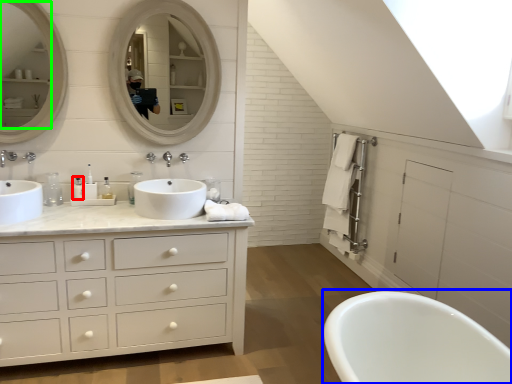
Question: Based on their relative distances, which object is farther from toiletry (highlighted by a red box)? Choose from bath (highlighted by a blue box) and mirror (highlighted by a green box).

Choices:
 (A) bath
 (B) mirror

Answer: (A)